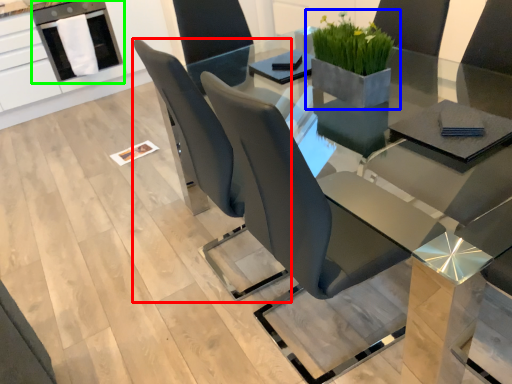
Question: Based on their relative distances, which object is farther from chair (highlighted by a red box)? Choose from houseplant (highlighted by a blue box) and dish washer (highlighted by a green box).

Choices:
 (A) houseplant
 (B) dish washer

Answer: (B)